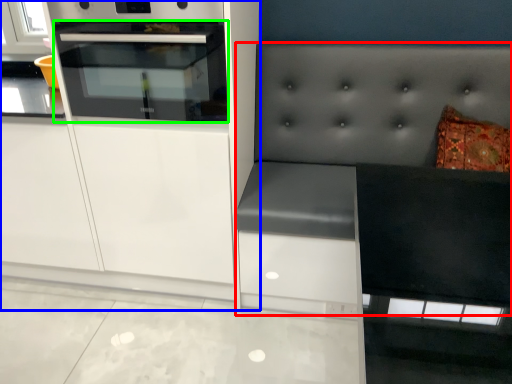
Question: Considering the real-world distances, which object is closest to couch (highlighted by a red box)? cabinetry (highlighted by a blue box) or oven (highlighted by a green box).

Choices:
 (A) cabinetry
 (B) oven

Answer: (A)